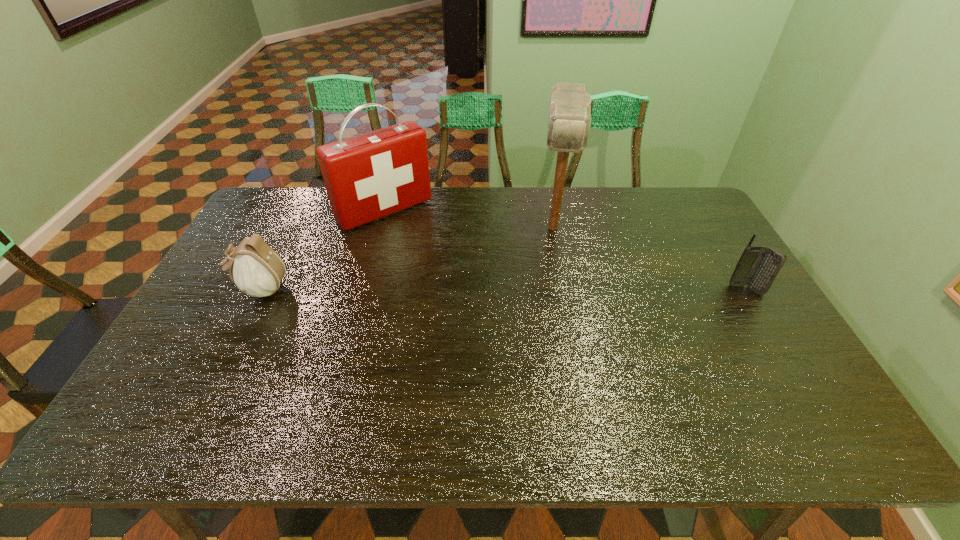
Find the location of a particular element. vacant spot on the desktop that is between the leftmost object and the cellular telephone and is positioned above the head of the mallet is located at coordinates (550, 289).

At what (x,y) coordinates should I click in order to perform the action: click on vacant space on the desktop that is between the leftmost object and the cellular telephone and is positioned on the front face of the first-aid kit. Please return your answer as a coordinate pair (x, y). Looking at the image, I should click on (458, 289).